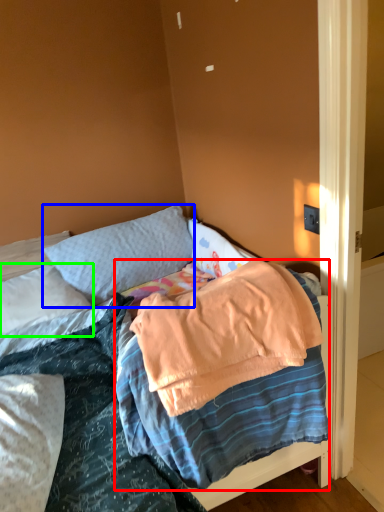
Question: Which is farther away from blanket (highlighted by a red box)? pillow (highlighted by a blue box) or pillow (highlighted by a green box)?

Choices:
 (A) pillow
 (B) pillow

Answer: (A)